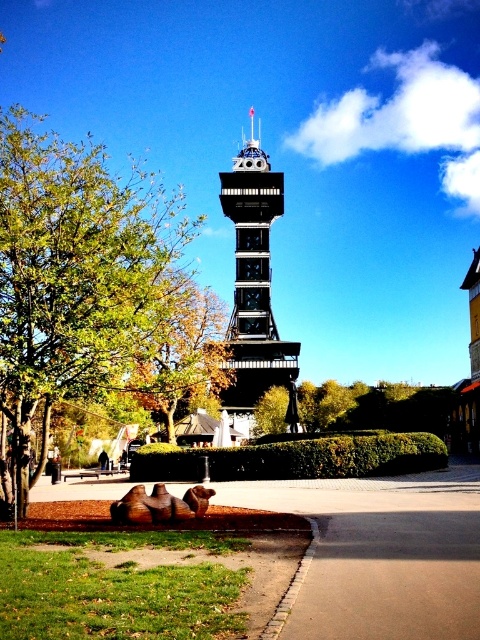
Question: Which object is the farthest from the green leafy tree at left?

Choices:
 (A) brown wood tree at center
 (B) green leafy tree at center
 (C) black metal bell tower at center

Answer: (B)

Question: Which object appears farthest from the camera in this image?

Choices:
 (A) green leafy tree at center
 (B) green leafy tree at left
 (C) black metal bell tower at center

Answer: (A)

Question: Which of the following is the closest to the observer?

Choices:
 (A) brown wood tree at center
 (B) green grass at lower left
 (C) green leafy tree at center
 (D) green leafy tree at left

Answer: (B)

Question: Is green grass at lower left thinner than brown wood tree at center?

Choices:
 (A) no
 (B) yes

Answer: (A)

Question: Considering the relative positions of green leafy tree at left and green grass at lower left in the image provided, where is green leafy tree at left located with respect to green grass at lower left?

Choices:
 (A) above
 (B) below

Answer: (A)

Question: Is green grass at lower left closer to camera compared to brown wood tree at center?

Choices:
 (A) no
 (B) yes

Answer: (B)